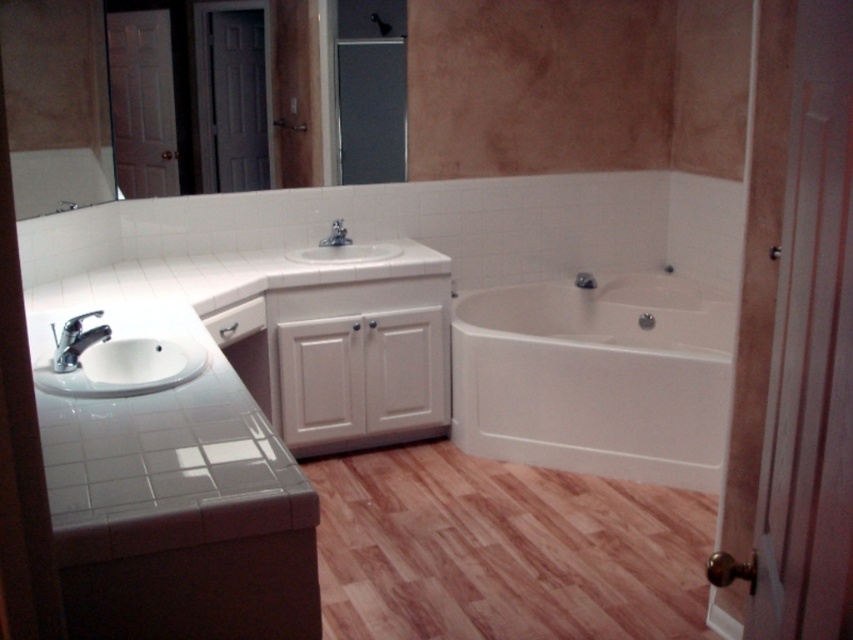
Does white glossy bathtub at center have a greater width compared to matte silver faucet at sink left?

Yes.

Which of these two, white glossy bathtub at center or matte silver faucet at sink left, stands taller?

Standing taller between the two is white glossy bathtub at center.

The height and width of the screenshot is (640, 853). What do you see at coordinates (596, 378) in the screenshot? I see `white glossy bathtub at center` at bounding box center [596, 378].

Locate an element on the screen. white glossy bathtub at center is located at coordinates (596, 378).

Describe the element at coordinates (123, 368) in the screenshot. I see `white glossy sink at left` at that location.

Is white glossy sink at left wider than matte silver faucet at sink left?

Yes.

Which is in front, point (59, 388) or point (77, 321)?

Positioned in front is point (59, 388).

What are the coordinates of `white glossy sink at left` in the screenshot? It's located at (123, 368).

Can you confirm if white glossy sink at center is positioned to the left of matte silver faucet at center?

Incorrect, white glossy sink at center is not on the left side of matte silver faucet at center.

Between white glossy sink at center and matte silver faucet at center, which one has more height?

With more height is white glossy sink at center.

Between point (306, 259) and point (329, 244), which one is positioned in front?

Point (306, 259)

Identify the location of white glossy sink at center. (345, 252).